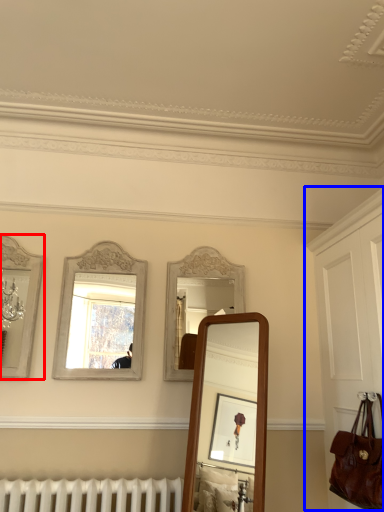
Question: Which object is further to the camera taking this photo, mirror (highlighted by a red box) or dresser (highlighted by a blue box)?

Choices:
 (A) mirror
 (B) dresser

Answer: (A)